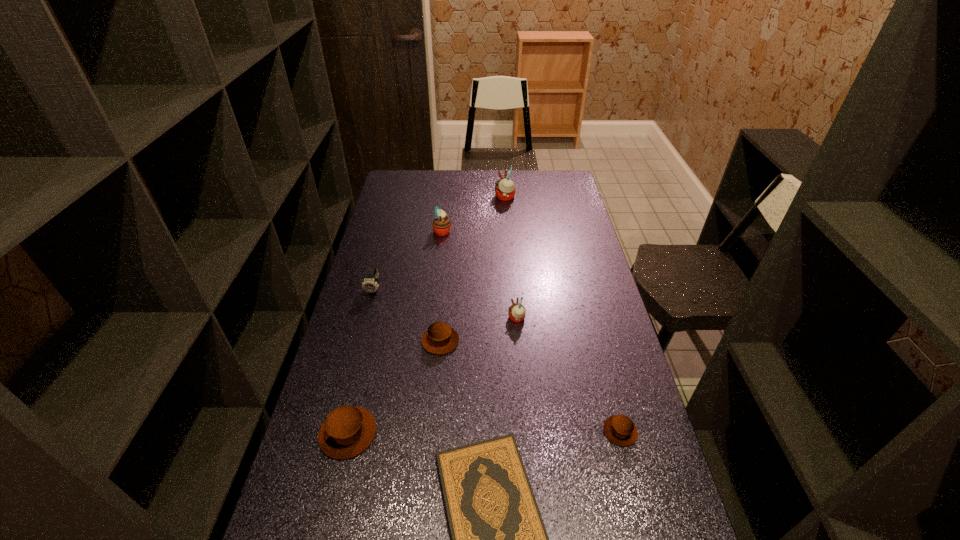
The height and width of the screenshot is (540, 960). Identify the location of free space located on the front-facing side of the third farthest muffin. (397, 319).

Where is `free space located on the front-facing side of the third farthest muffin`? free space located on the front-facing side of the third farthest muffin is located at coordinates (472, 319).

In order to click on vacant point located 0.400m on the right of the leftmost muffin in this screenshot , I will do `click(528, 433)`.

I want to click on vacant space situated on the left of the farthest brown muffin, so click(x=399, y=341).

Where is `vacant space positioned 0.340m on the left of the rightmost muffin`? This screenshot has height=540, width=960. vacant space positioned 0.340m on the left of the rightmost muffin is located at coordinates (475, 431).

At what (x,y) coordinates should I click in order to perform the action: click on object present at the far edge. Please return your answer as a coordinate pair (x, y). This screenshot has height=540, width=960. Looking at the image, I should click on (505, 189).

Find the location of a particular element. watch that is at the left edge is located at coordinates (370, 284).

Locate an element on the screen. muffin present at the left edge is located at coordinates (347, 431).

At what (x,y) coordinates should I click in order to perform the action: click on object located in the right edge section of the desktop. Please return your answer as a coordinate pair (x, y). Image resolution: width=960 pixels, height=540 pixels. Looking at the image, I should click on (619, 429).

Locate an element on the screen. The height and width of the screenshot is (540, 960). free space at the far edge of the desktop is located at coordinates (528, 174).